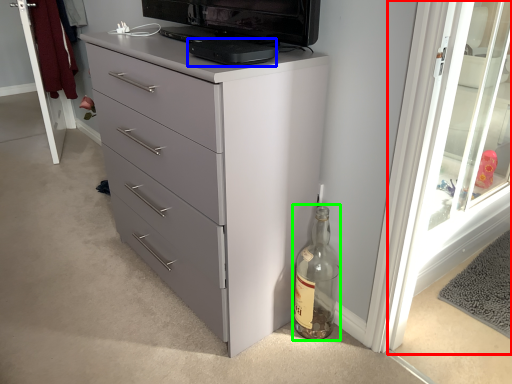
Question: Which object is positioned closest to screen door (highlighted by a red box)? Select from appliance (highlighted by a blue box) and glass bottle (highlighted by a green box).

Choices:
 (A) appliance
 (B) glass bottle

Answer: (B)